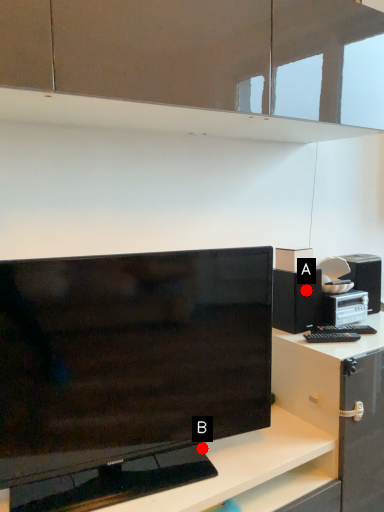
Question: Two points are circled on the image, labeled by A and B beside each circle. Which point is closer to the camera taking this photo?

Choices:
 (A) A is closer
 (B) B is closer

Answer: (B)